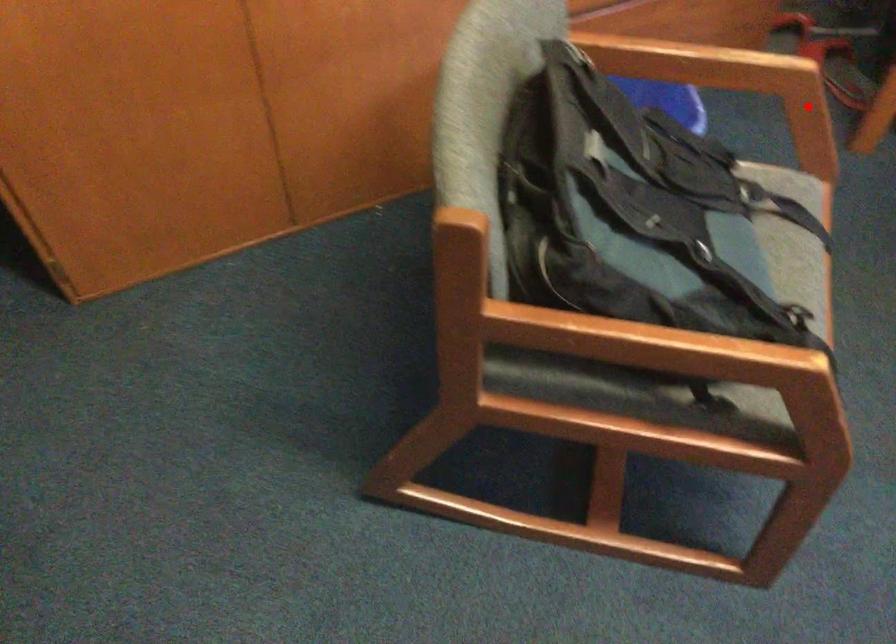
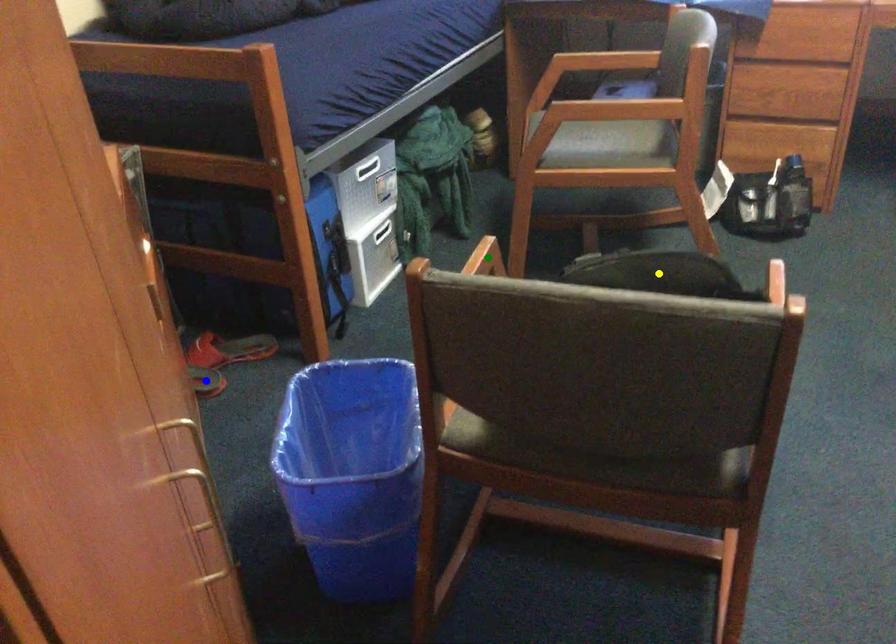
Question: I am providing you with two images of the same scene from different viewpoints. A red point is marked on the first image. You are given multiple points on the second image. Which mark in image 2 goes with the point in image 1?

Choices:
 (A) green point
 (B) yellow point
 (C) blue point

Answer: (A)